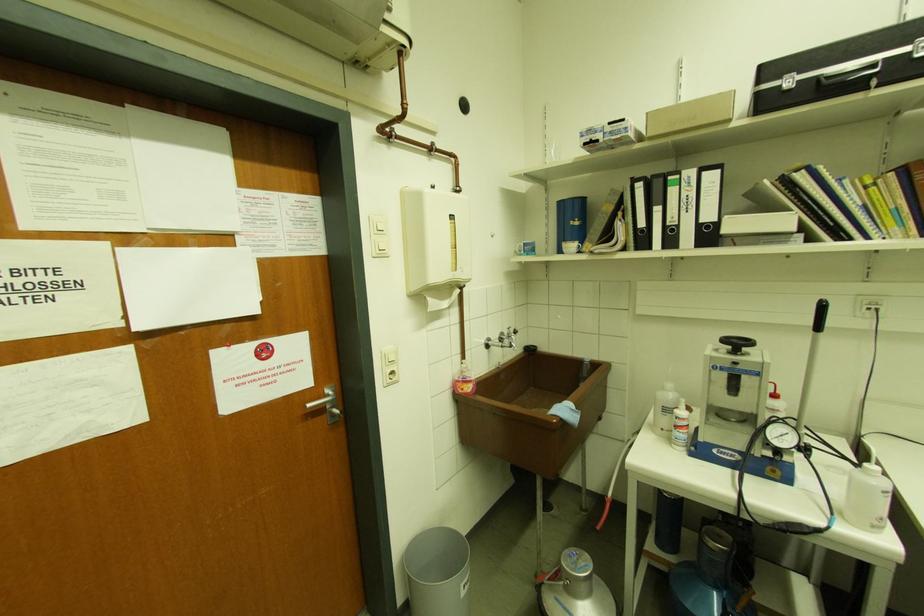
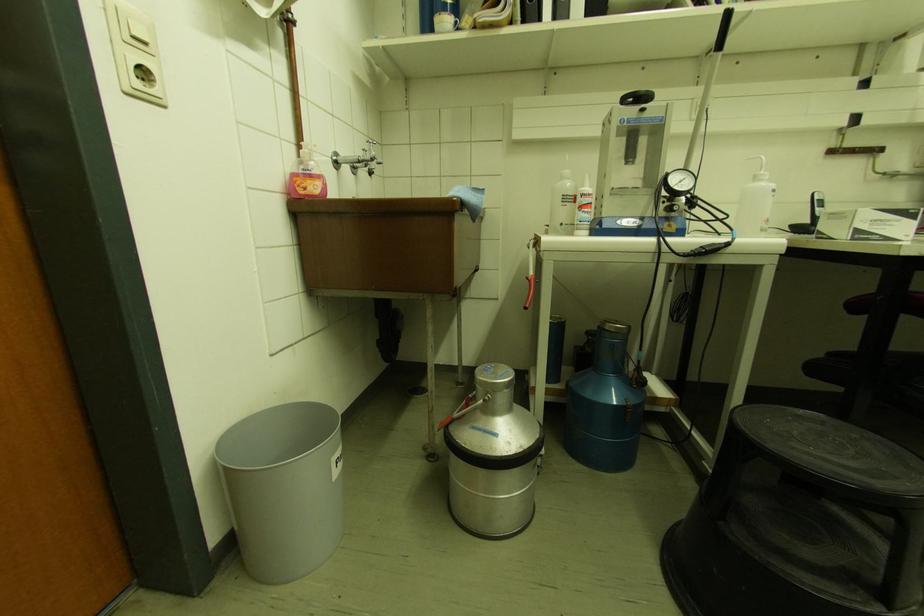
In the second image, find the point that corresponds to (x=468, y=582) in the first image.

(341, 455)